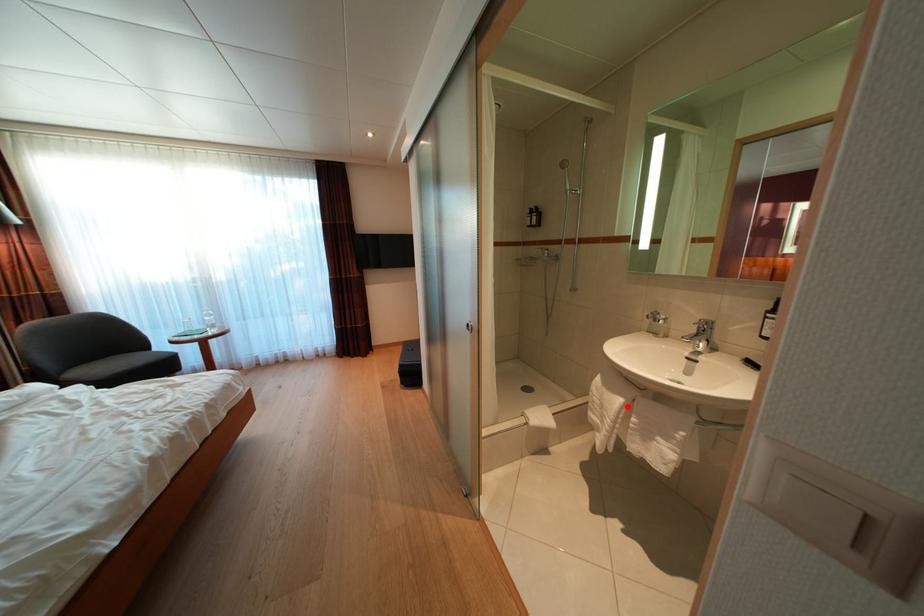
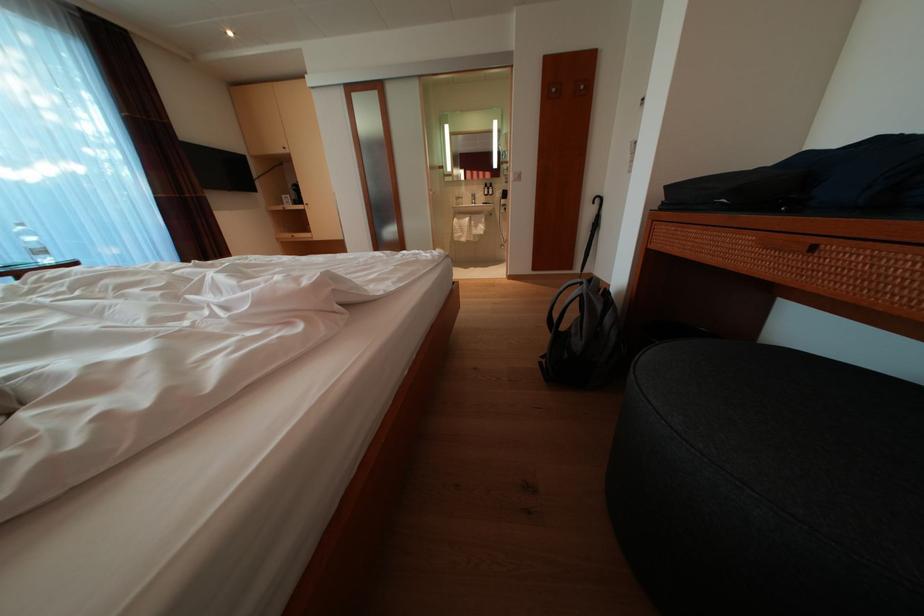
Find the pixel in the second image that matches the highlighted location in the first image.

(476, 225)